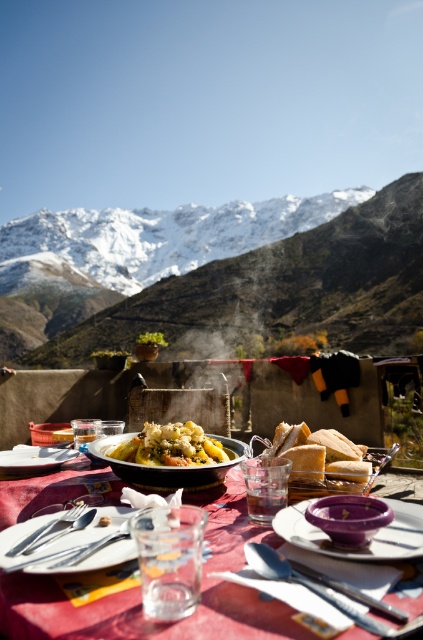
Does point (5, 564) come behind point (189, 422)?

No, (5, 564) is closer to viewer.

Can you confirm if matte silver platter at center is shorter than golden brown pasta at center?

Yes.

This screenshot has width=423, height=640. Describe the element at coordinates (71, 544) in the screenshot. I see `matte silver platter at center` at that location.

The width and height of the screenshot is (423, 640). Find the location of `matte silver platter at center`. matte silver platter at center is located at coordinates (71, 544).

Is point (272, 444) positioned before point (47, 460)?

Yes, point (272, 444) is in front of point (47, 460).

Does golden brown bread at center appear on the left side of matte black platter at lower left?

In fact, golden brown bread at center is to the right of matte black platter at lower left.

Which is in front, point (343, 474) or point (38, 456)?

Point (343, 474) is more forward.

Image resolution: width=423 pixels, height=640 pixels. Find the location of `golden brown bread at center`. golden brown bread at center is located at coordinates (321, 460).

Looking at this image, is translucent glass water at center smaller than matte ceramic platter at center?

Actually, translucent glass water at center might be larger than matte ceramic platter at center.

Which is more to the right, translucent glass water at center or matte ceramic platter at center?

translucent glass water at center is more to the right.

Does point (52, 612) come in front of point (180, 483)?

That is True.

Where is `translucent glass water at center`? Image resolution: width=423 pixels, height=640 pixels. translucent glass water at center is located at coordinates (140, 595).